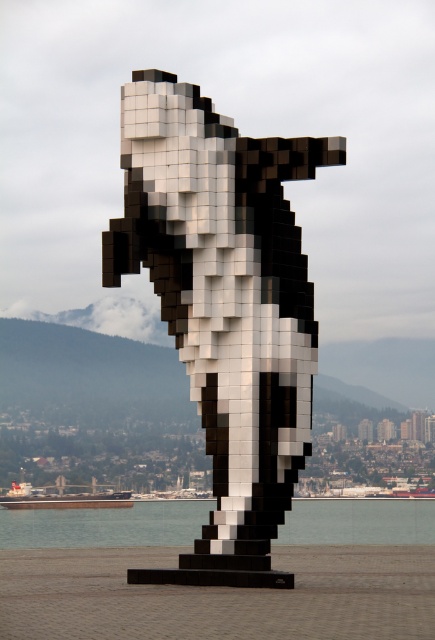
You are a tourist standing in front of the sculpture. You want to take a photo that includes both the black pixelated orca at center and the transparent glass water at lower center. Which object should you focus on first to ensure both are in clear view?

You should focus on the black pixelated orca at center first since it is closer to you than the transparent glass water at lower center. By focusing on the closer object, both will be in focus as the transparent glass water at lower center is further away and within the depth of field.

You are an artist planning to photograph the black pixelated orca at center and the transparent glass water at lower center. Which object should you focus on first if you want to capture both in a single frame without moving the camera?

You should focus on the black pixelated orca at center first because it is smaller than the transparent glass water at lower center, so it will require a closer look to ensure details are captured clearly while still fitting both into the frame.

You are an architect designing a new public plaza. You want to place a bench so that visitors can see both the black pixelated orca at center and the transparent glass water at lower center without obstruction. Based on the scene, which object is taller and might block the view of the other?

The black pixelated orca at center is taller than the transparent glass water at lower center. Therefore, the orca might block the view of the transparent glass water at lower center if placed in between.